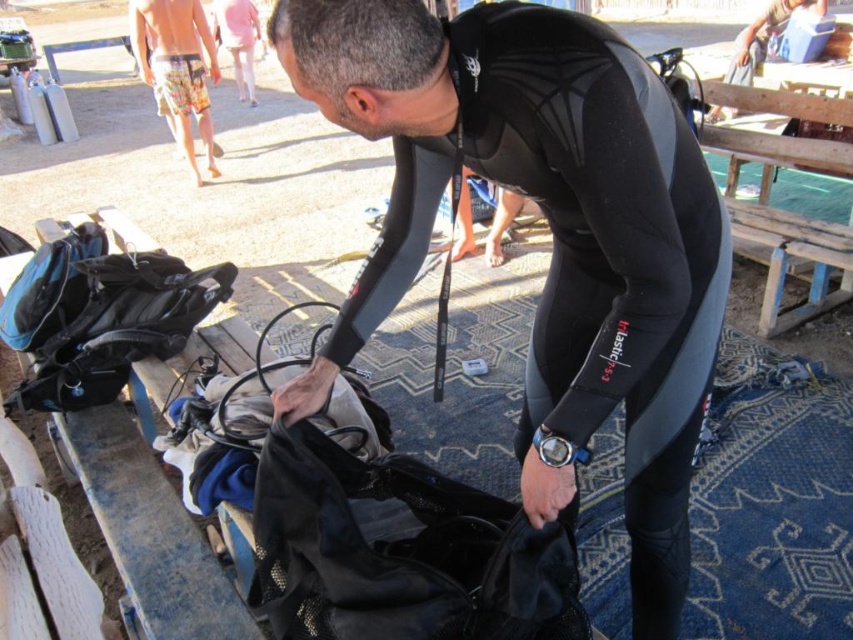
You are a safety inspector checking the setup for a diving activity. You notice the black neoprene wetsuit at center and the pink fabric pants at upper center. According to safety protocols, these two items must be kept at least 8 meters apart to prevent contamination. Are they currently compliant with this requirement?

The black neoprene wetsuit at center is 7.49 meters away from the pink fabric pants at upper center. Since 7.49 meters is less than the required 8 meters, they are not compliant with the safety protocol.